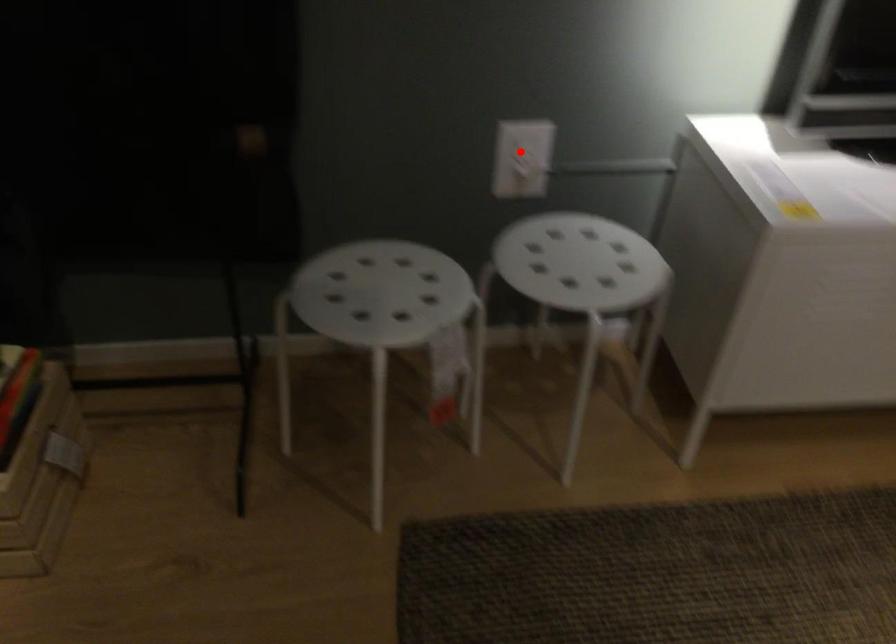
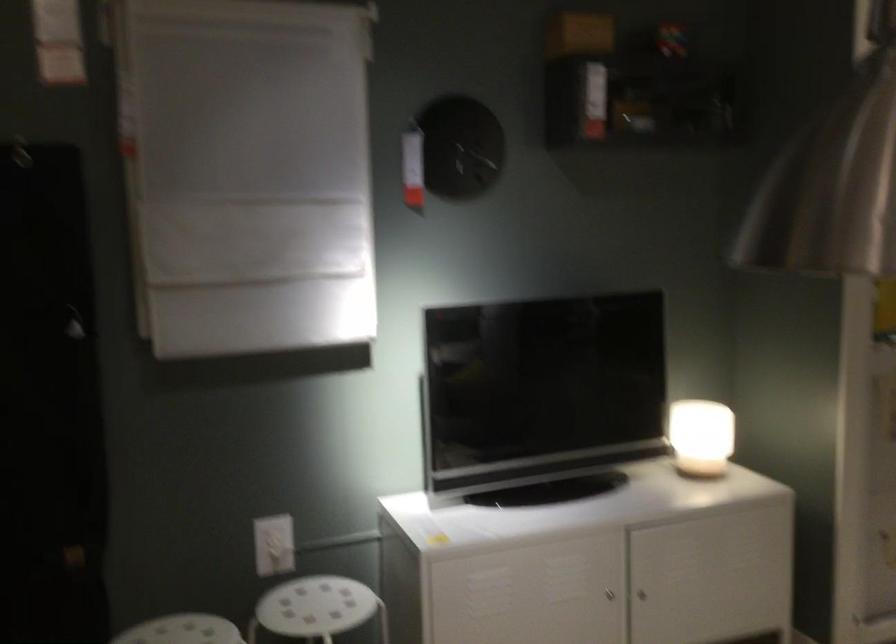
Question: I am providing you with two images of the same scene from different viewpoints. In image1, a red point is highlighted. Considering the same 3D point in image2, which of the following is correct?

Choices:
 (A) It is closer
 (B) It is farther

Answer: (B)